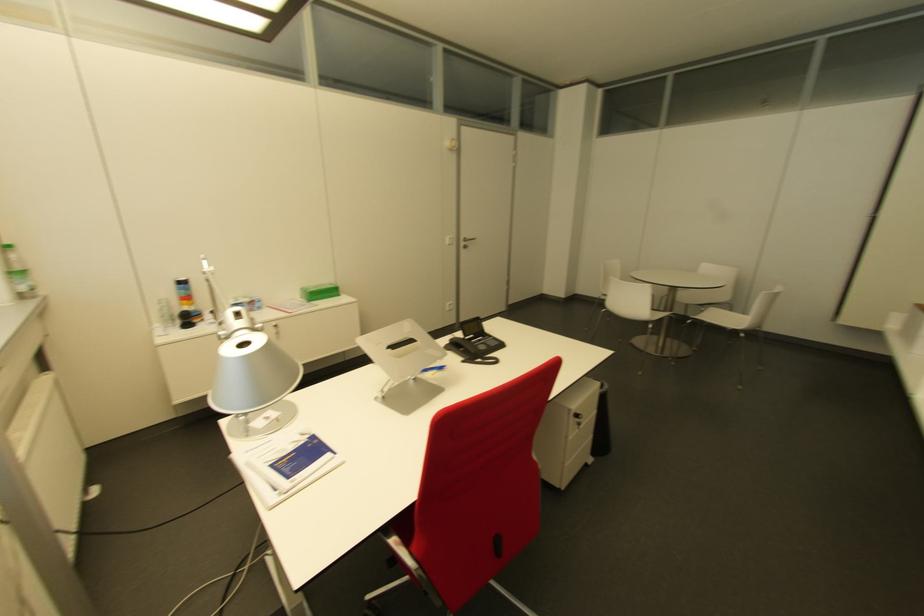
Which object does [433,368] point to?

This point indicates the blue pen.